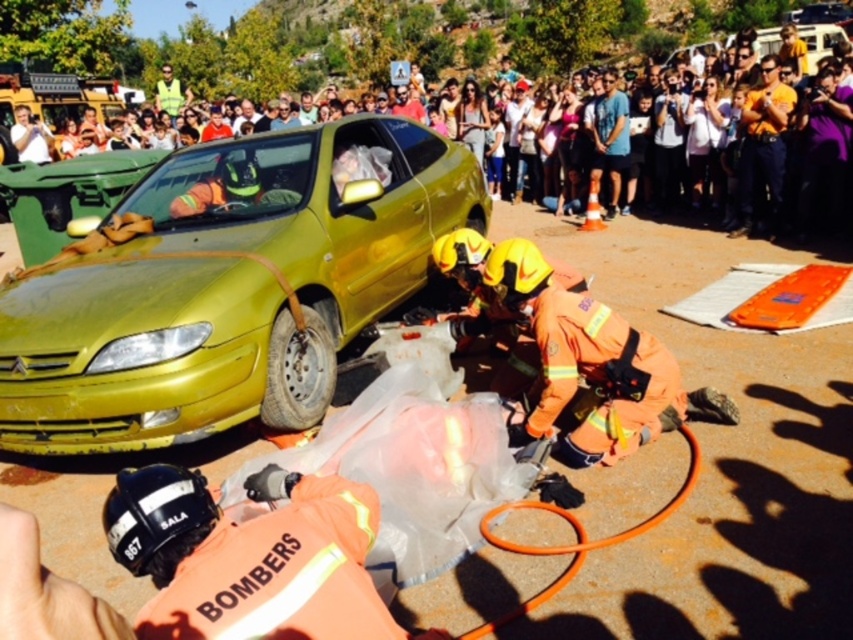
Consider the image. You are a traffic officer assessing the scene. The metallic yellow car at left and the matte yellow car at center are both involved in the accident. Which car has a narrower width according to the scene description?

The metallic yellow car at left is thinner than the matte yellow car at center, so the metallic yellow car at left has a narrower width.